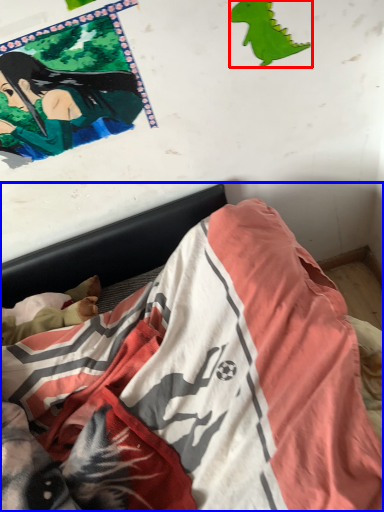
Question: Which of the following is the closest to the observer, print (highlighted by a red box) or bed (highlighted by a blue box)?

Choices:
 (A) print
 (B) bed

Answer: (B)